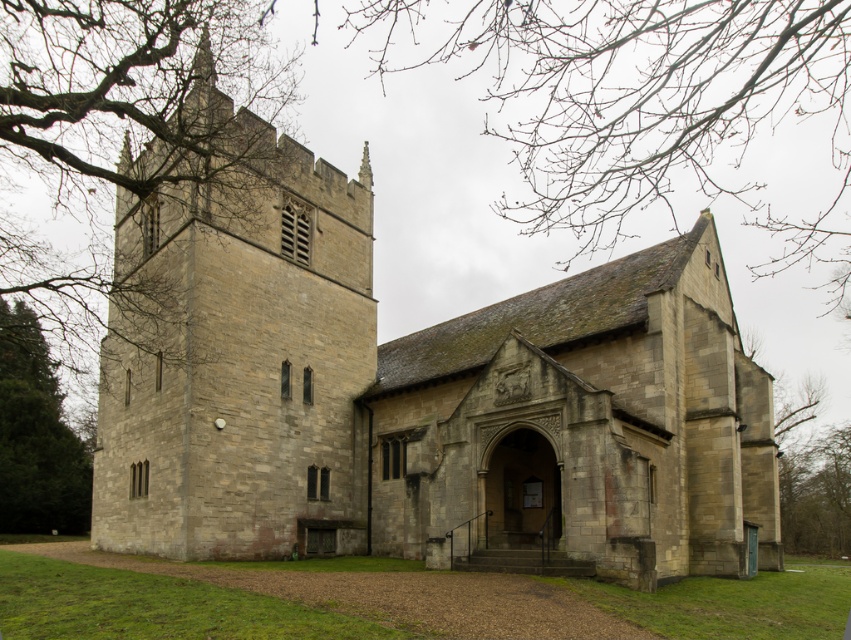
You are standing in front of the historic stone church and want to take a photo that includes both the bare branches at upper center and the green leafy tree at left. Which object should you position closer to the front of your camera frame to ensure both are in focus?

You should position the bare branches at upper center closer to the front of your camera frame because it is closer to the viewer than the green leafy tree at left, ensuring both are in focus.

From the picture: What object is located at the coordinates point (644, 100) in the image?

The point (644, 100) corresponds to bare branches at upper center.